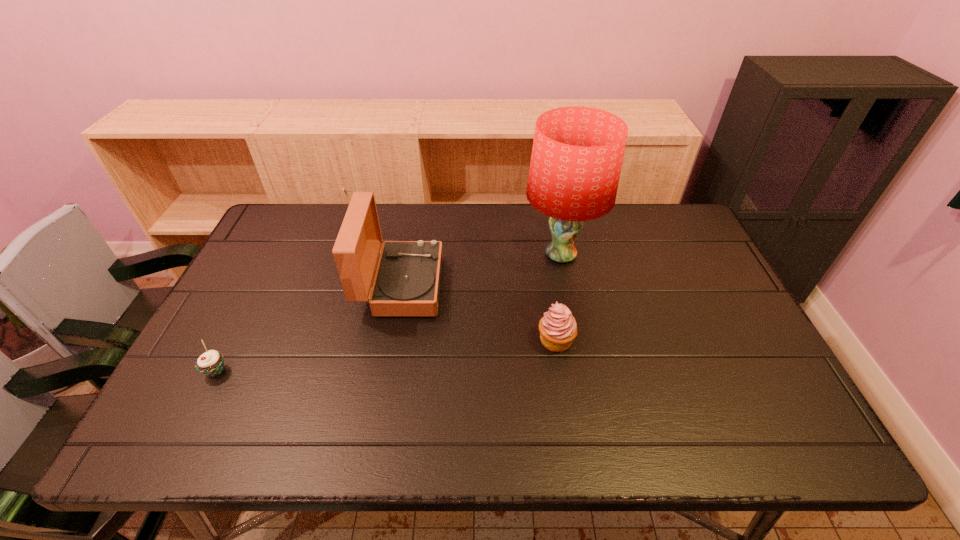
Point out which object is positioned as the nearest to the nearer cupcake. Please provide its 2D coordinates. Your answer should be formatted as a tuple, i.e. [(x, y)], where the tuple contains the x and y coordinates of a point satisfying the conditions above.

[(407, 281)]

Find the location of a particular element. The height and width of the screenshot is (540, 960). vacant space that satisfies the following two spatial constraints: 1. on the back side of the farther cupcake; 2. on the right side of the shorter cupcake is located at coordinates (231, 340).

At what (x,y) coordinates should I click in order to perform the action: click on free location that satisfies the following two spatial constraints: 1. on the face of the phonograph record; 2. on the front side of the left cupcake. Please return your answer as a coordinate pair (x, y). Image resolution: width=960 pixels, height=540 pixels. Looking at the image, I should click on (386, 371).